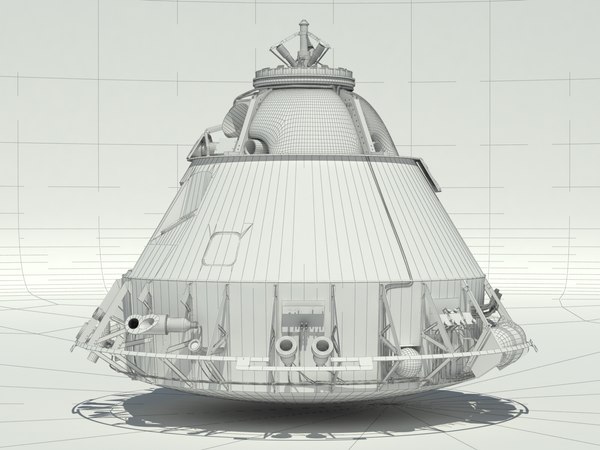
Where is `archway`? archway is located at coordinates [290, 33], [312, 37].